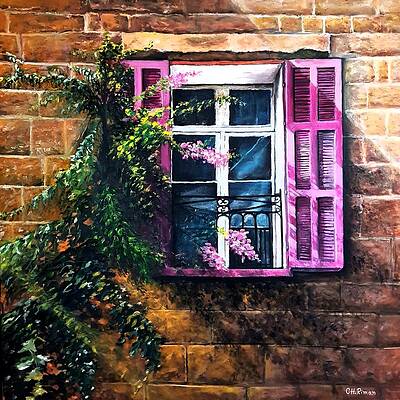
Where is `window frame`? window frame is located at coordinates (222, 128).